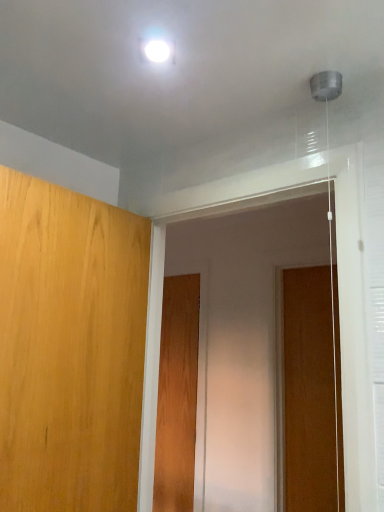
Question: Can you confirm if light brown wood door at left, the 3th door viewed from the back, is shorter than wooden door at right, which appears as the third door when viewed from the left?

Choices:
 (A) yes
 (B) no

Answer: (A)

Question: Is there a large distance between light brown wood door at left, the 3th door viewed from the back, and wooden door at right, which appears as the third door when viewed from the left?

Choices:
 (A) yes
 (B) no

Answer: (A)

Question: Considering the relative sizes of light brown wood door at left, the 3th door viewed from the back, and wooden door at right, acting as the 2th door starting from the back, in the image provided, is light brown wood door at left, the 3th door viewed from the back, taller than wooden door at right, acting as the 2th door starting from the back,?

Choices:
 (A) yes
 (B) no

Answer: (B)

Question: Is light brown wood door at left, the 3th door viewed from the back, placed right next to wooden door at right, which appears as the third door when viewed from the left?

Choices:
 (A) no
 (B) yes

Answer: (A)

Question: Is light brown wood door at left, marked as the first door in a front-to-back arrangement, turned away from wooden door at right, which appears as the third door when viewed from the left?

Choices:
 (A) no
 (B) yes

Answer: (A)

Question: Can you confirm if light brown wood door at left, the first door positioned from the left, is smaller than wooden door at right, the second door in the front-to-back sequence?

Choices:
 (A) yes
 (B) no

Answer: (B)

Question: Is wooden door at right, the 1th door from the right, not within transparent plastic screen door at center?

Choices:
 (A) yes
 (B) no

Answer: (A)

Question: Is wooden door at right, the second door in the front-to-back sequence, smaller than transparent plastic screen door at center?

Choices:
 (A) yes
 (B) no

Answer: (A)

Question: Is wooden door at right, the 1th door from the right, next to transparent plastic screen door at center?

Choices:
 (A) no
 (B) yes

Answer: (A)

Question: Considering the relative sizes of wooden door at right, acting as the 2th door starting from the back, and transparent plastic screen door at center in the image provided, is wooden door at right, acting as the 2th door starting from the back, thinner than transparent plastic screen door at center?

Choices:
 (A) no
 (B) yes

Answer: (B)

Question: Is wooden door at right, which appears as the third door when viewed from the left, wider than transparent plastic screen door at center?

Choices:
 (A) yes
 (B) no

Answer: (B)

Question: Considering the relative positions of wooden door at right, acting as the 2th door starting from the back, and transparent plastic screen door at center in the image provided, is wooden door at right, acting as the 2th door starting from the back, behind transparent plastic screen door at center?

Choices:
 (A) yes
 (B) no

Answer: (A)

Question: From the image's perspective, does wooden door at right, the second door in the front-to-back sequence, appear lower than wooden door at center, which is the 2th door in left-to-right order?

Choices:
 (A) no
 (B) yes

Answer: (A)